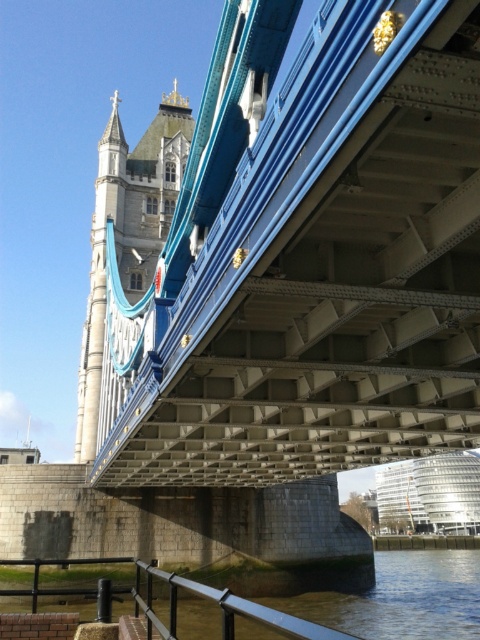
What do you see at coordinates (326, 272) in the screenshot? I see `metallic blue suspension bridge at center` at bounding box center [326, 272].

The height and width of the screenshot is (640, 480). Identify the location of metallic blue suspension bridge at center. (326, 272).

In order to click on metallic blue suspension bridge at center in this screenshot , I will do `click(326, 272)`.